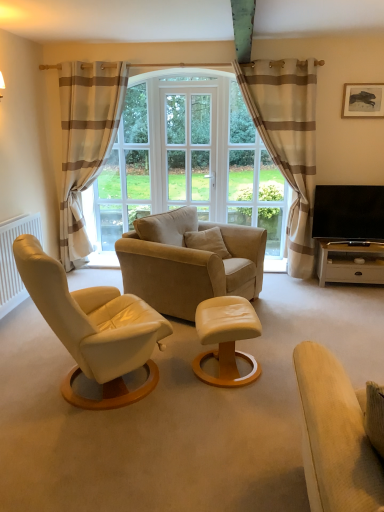
Find the location of a particular element. Image resolution: width=384 pixels, height=512 pixels. vacant space behind light beige fabric studio couch at lower right is located at coordinates (281, 472).